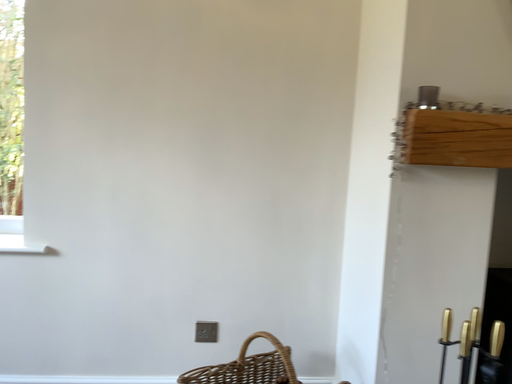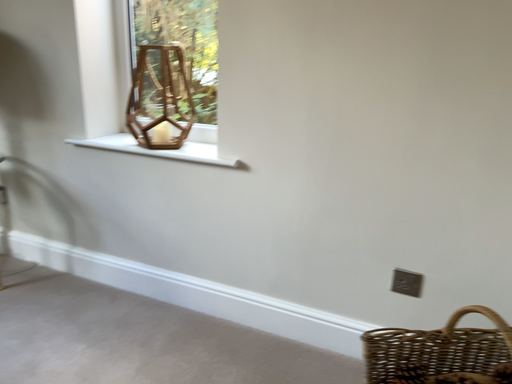
Question: How did the camera likely rotate when shooting the video?

Choices:
 (A) rotated upward
 (B) rotated downward

Answer: (B)